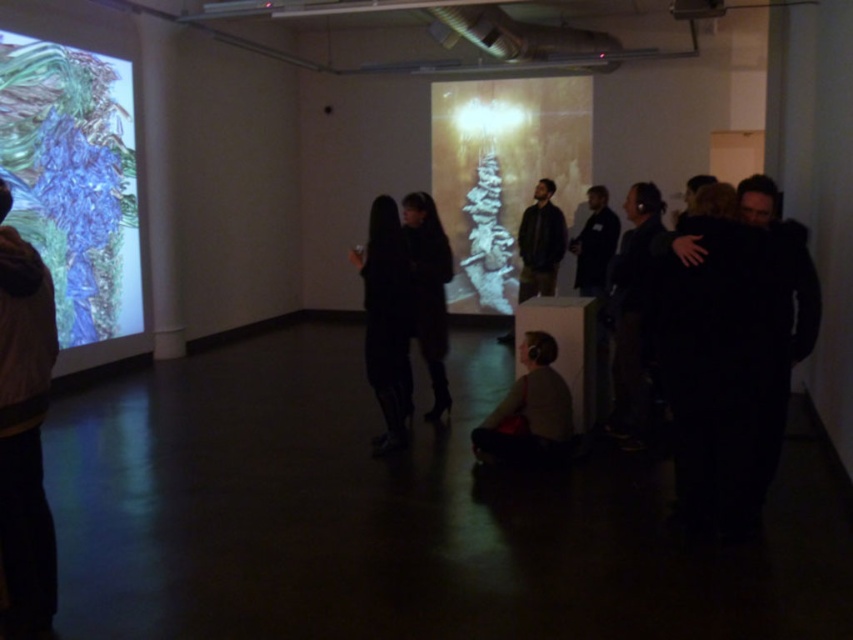
You are standing in the center of the room facing the two projections. There are two points marked in the room, one at point (735,360) and the other at point (42,305). Which point is closer to you when you are facing the projections?

Point (42,305) is closer to you because it is in front of point (735,360).

Consider the image. You are standing in the gallery and want to take a photo of both the dark gray sweater at lower center and the black leather boots at center. Which object should you adjust your camera angle to capture first if you want to include both in the same frame?

You should adjust your camera angle to capture the dark gray sweater at lower center first because it is positioned below the black leather boots at center, so you need to ensure the lower area is framed to include both.